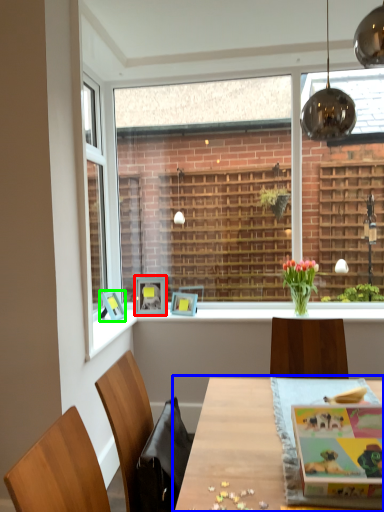
Question: Estimate the real-world distances between objects in this image. Which object is farther from picture frame (highlighted by a red box), table (highlighted by a blue box) or picture frame (highlighted by a green box)?

Choices:
 (A) table
 (B) picture frame

Answer: (A)